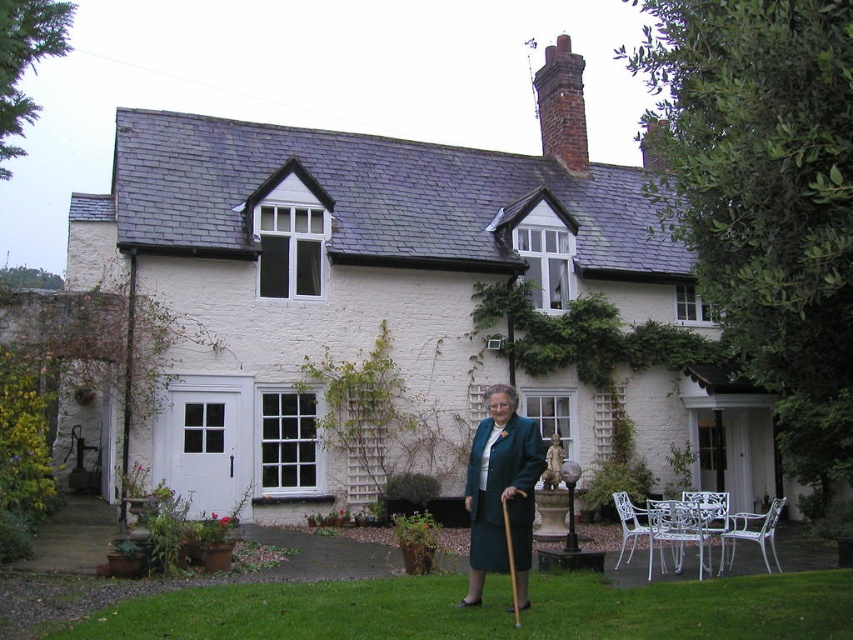
Question: Among these points, which one is nearest to the camera?

Choices:
 (A) (427, 250)
 (B) (334, 634)

Answer: (B)

Question: Is white painted brick cottage at center positioned before green grass at lower center?

Choices:
 (A) yes
 (B) no

Answer: (B)

Question: Which of the following is the farthest from the observer?

Choices:
 (A) (490, 467)
 (B) (151, 602)

Answer: (A)

Question: Which point is closer to the camera?

Choices:
 (A) teal fabric coat at center
 (B) green grass at lower center
 (C) white painted brick cottage at center

Answer: (B)

Question: Does white painted brick cottage at center appear on the right side of green grass at lower center?

Choices:
 (A) yes
 (B) no

Answer: (B)

Question: Is white painted brick cottage at center further to camera compared to green grass at lower center?

Choices:
 (A) yes
 (B) no

Answer: (A)